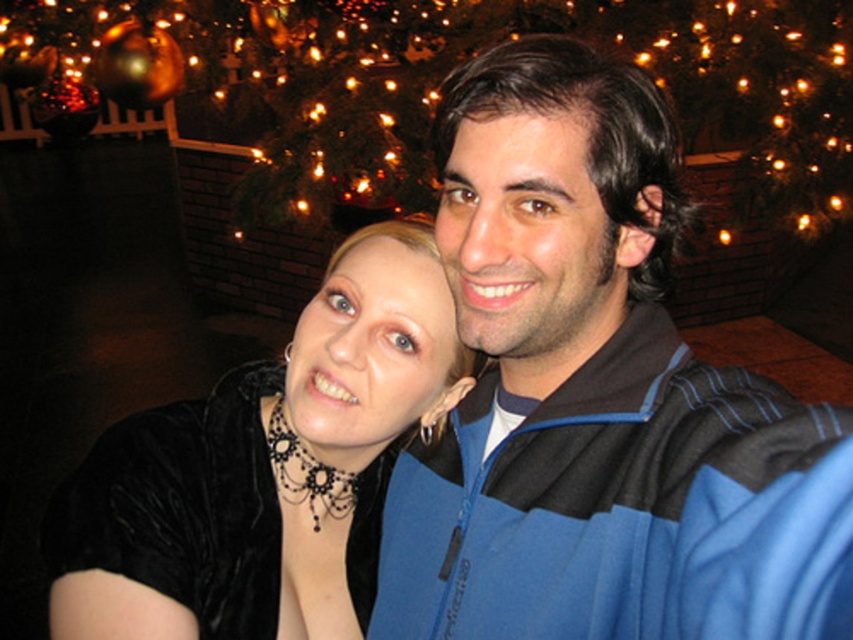
Question: Which object is closer to the camera taking this photo?

Choices:
 (A) metallic gold ornament at upper center
 (B) velvet black dress at center

Answer: (B)

Question: Which point is farther from the camera taking this photo?

Choices:
 (A) (84, 624)
 (B) (305, 108)

Answer: (B)

Question: Can you confirm if velvet black dress at center is wider than metallic gold ornament at upper center?

Choices:
 (A) yes
 (B) no

Answer: (B)

Question: Can you confirm if velvet black dress at center is bigger than metallic gold ornament at upper center?

Choices:
 (A) yes
 (B) no

Answer: (B)

Question: Observing the image, what is the correct spatial positioning of velvet black dress at center in reference to metallic gold ornament at upper center?

Choices:
 (A) left
 (B) right

Answer: (A)